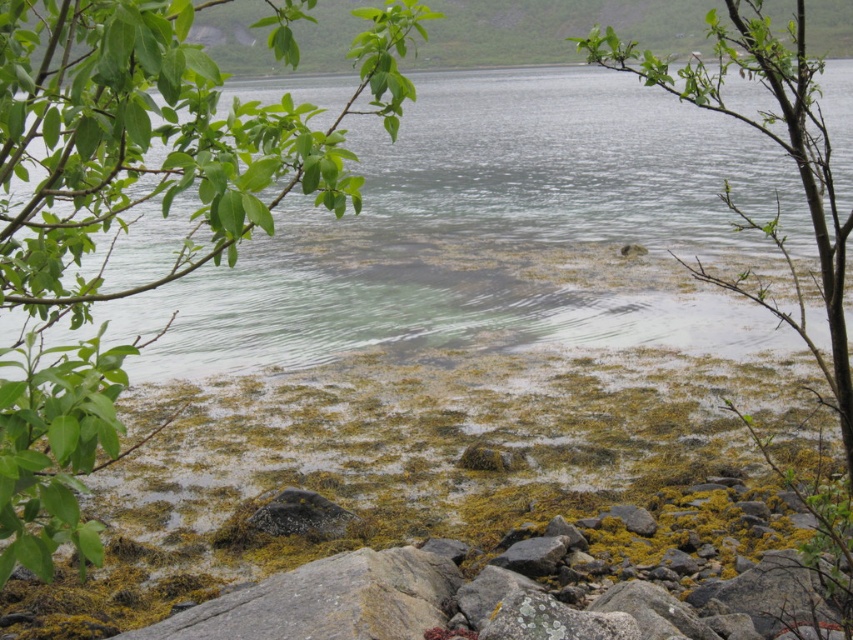
Question: From the image, what is the correct spatial relationship of green algae at center in relation to green leafy branch at upper center?

Choices:
 (A) left
 (B) right

Answer: (A)

Question: Is the position of green leafy branch at upper left more distant than that of gray rough rock at center?

Choices:
 (A) yes
 (B) no

Answer: (B)

Question: Which object is the farthest from the green algae at center?

Choices:
 (A) green leafy branch at upper left
 (B) green leafy branch at upper center

Answer: (A)

Question: Is green algae at center wider than green leafy branch at upper left?

Choices:
 (A) no
 (B) yes

Answer: (B)

Question: Among these objects, which one is farthest from the camera?

Choices:
 (A) gray rough rock at center
 (B) green leafy branch at upper left
 (C) green leafy branch at upper center

Answer: (A)

Question: Which object is positioned closest to the green algae at center?

Choices:
 (A) gray rough rock at center
 (B) green leafy branch at upper left
 (C) green leafy branch at upper center

Answer: (C)